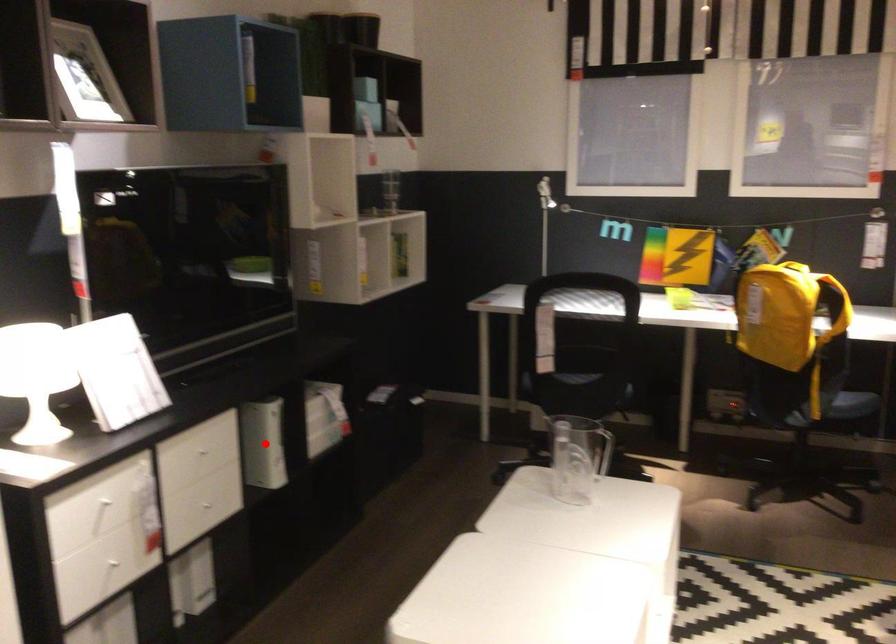
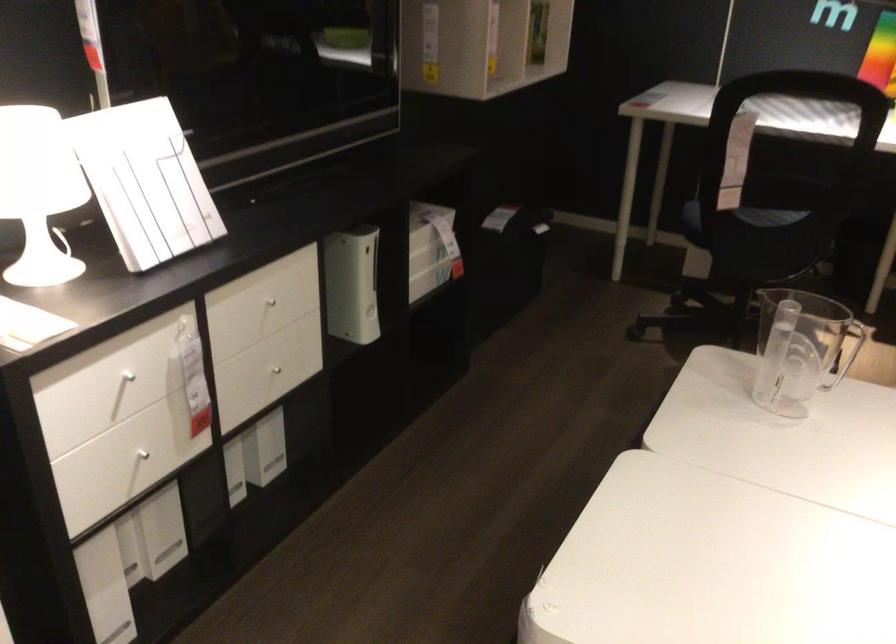
Find the pixel in the second image that matches the highlighted location in the first image.

(351, 285)